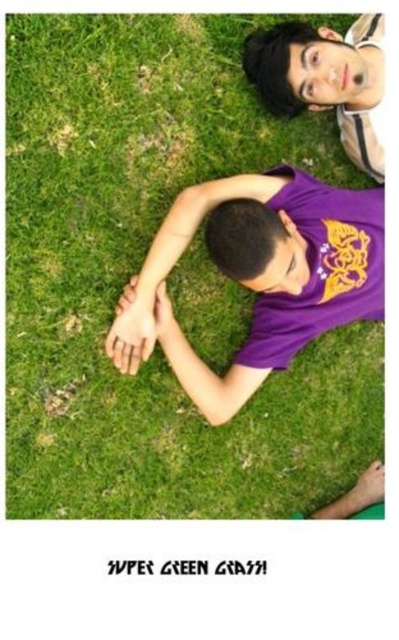
Question: Estimate the real-world distances between objects in this image. Which object is farther from the purple matte shirt at center?

Choices:
 (A) green grass at upper center
 (B) smooth skin hand at center
 (C) matte skin hand at lower right
 (D) matte purple shirt at upper center

Answer: (C)

Question: Which point appears farthest from the camera in this image?

Choices:
 (A) (165, 301)
 (B) (310, 125)
 (C) (373, 88)
 (D) (355, 493)

Answer: (D)

Question: Among these points, which one is nearest to the camera?

Choices:
 (A) (355, 22)
 (B) (361, 298)
 (C) (15, 36)
 (D) (379, 467)

Answer: (C)

Question: Observing the image, what is the correct spatial positioning of smooth skin hand at center in reference to matte skin hand at lower right?

Choices:
 (A) above
 (B) below

Answer: (A)

Question: Does purple matte shirt at center appear over matte purple shirt at upper center?

Choices:
 (A) yes
 (B) no

Answer: (B)

Question: Can you confirm if purple matte shirt at center is positioned above matte purple shirt at upper center?

Choices:
 (A) yes
 (B) no

Answer: (B)